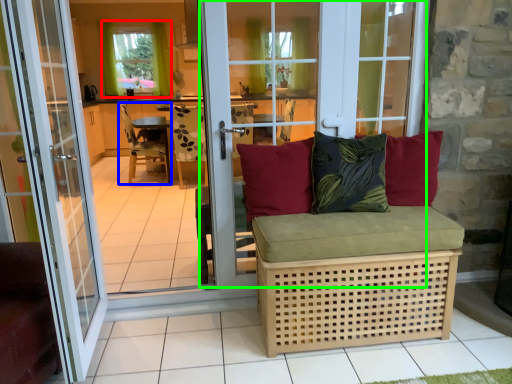
Question: Which object is positioned farthest from window (highlighted by a red box)? Select from chair (highlighted by a blue box) and glass door (highlighted by a green box).

Choices:
 (A) chair
 (B) glass door

Answer: (B)